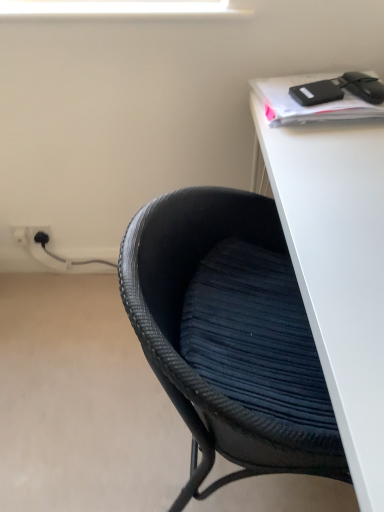
Question: Is point (44, 230) positioned closer to the camera than point (360, 394)?

Choices:
 (A) closer
 (B) farther

Answer: (B)

Question: Considering the relative positions of white plastic electric outlet at lower left, which ranks as the first electric outlet in right-to-left order, and white matte desk at upper right in the image provided, is white plastic electric outlet at lower left, which ranks as the first electric outlet in right-to-left order, to the left or to the right of white matte desk at upper right?

Choices:
 (A) right
 (B) left

Answer: (B)

Question: Estimate the real-world distances between objects in this image. Which object is farther from the white matte desk at upper right?

Choices:
 (A) black woven chair at lower left
 (B) white plastic electric outlet at lower left, which ranks as the first electric outlet in right-to-left order
 (C) white plastic electric outlet at lower left, the 2th electric outlet when ordered from right to left

Answer: (C)

Question: Which object is the farthest from the black woven chair at lower left?

Choices:
 (A) white matte desk at upper right
 (B) white plastic electric outlet at lower left, the 2th electric outlet when ordered from right to left
 (C) white plastic electric outlet at lower left, the 2th electric outlet when ordered from left to right

Answer: (B)